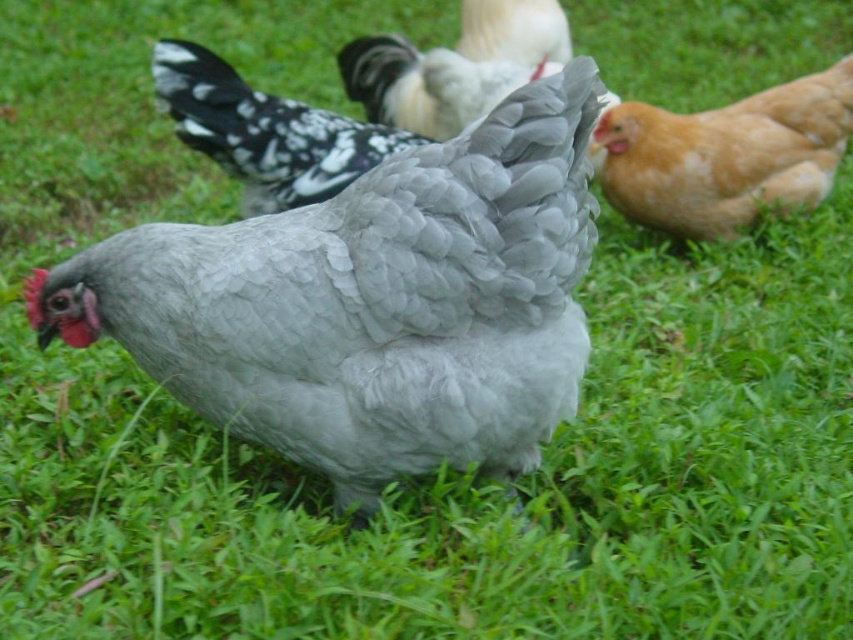
Who is positioned more to the right, gray feathered chicken at center or white speckled feathers at center?

From the viewer's perspective, white speckled feathers at center appears more on the right side.

Between point (527, 241) and point (376, 96), which one is positioned behind?

The point (376, 96) is behind.

Between point (357, 477) and point (422, 52), which one is positioned in front?

Positioned in front is point (357, 477).

In order to click on gray feathered chicken at center in this screenshot , I will do `click(370, 301)`.

Which is more to the right, silvery-gray feathered chicken at center or white speckled feathers at center?

From the viewer's perspective, white speckled feathers at center appears more on the right side.

Which is in front, point (200, 115) or point (482, 4)?

Point (200, 115) is more forward.

Identify the location of silvery-gray feathered chicken at center. The image size is (853, 640). (264, 131).

Does golden feathered chicken at right have a lesser height compared to white speckled feathers at center?

Incorrect, golden feathered chicken at right's height does not fall short of white speckled feathers at center's.

Which of these two, golden feathered chicken at right or white speckled feathers at center, stands shorter?

white speckled feathers at center

Is point (637, 180) positioned in front of point (529, 22)?

Yes, point (637, 180) is in front of point (529, 22).

The width and height of the screenshot is (853, 640). I want to click on golden feathered chicken at right, so click(724, 156).